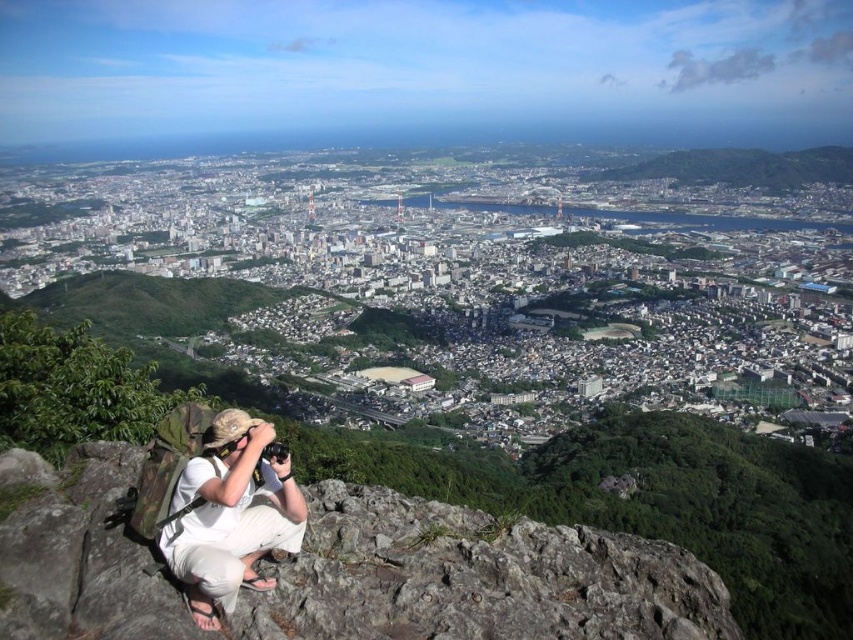
From the picture: You are a photographer standing at the rocky outcrop in the foreground of the urban landscape. You want to capture a photo that includes both the point at coordinates point [500,630] and point [260,428]. Which point should you focus on first to ensure both are in sharp focus?

You should focus on point [500,630] first because it is closer to the camera than point [260,428]. By focusing on the closer point, the farther point will also be within the depth of field and in focus.

You are a hiker standing at the point marked by the coordinates (344,570). Based on the scene description, what type of terrain are you currently on?

The coordinates (344,570) mark the gray rocky cliff at lower left, so you are standing on a rocky cliff.

You are a hiker trying to navigate the rocky terrain. You notice the gray rocky cliff at lower left and the white cotton shirt at lower left. Which object is taller from your viewpoint?

The gray rocky cliff at lower left is not as tall as the white cotton shirt at lower left, so the white cotton shirt at lower left is taller.